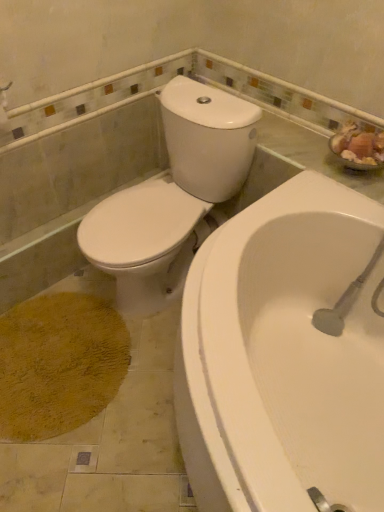
Question: Is white glossy bathtub at lower right inside or outside of white glossy toilet at upper left?

Choices:
 (A) inside
 (B) outside

Answer: (B)

Question: From the image's perspective, is white glossy bathtub at lower right positioned above or below white glossy toilet at upper left?

Choices:
 (A) above
 (B) below

Answer: (B)

Question: Based on their sizes in the image, would you say white glossy bathtub at lower right is bigger or smaller than white glossy toilet at upper left?

Choices:
 (A) small
 (B) big

Answer: (B)

Question: Considering the positions of point (213, 90) and point (251, 399), is point (213, 90) closer or farther from the camera than point (251, 399)?

Choices:
 (A) farther
 (B) closer

Answer: (A)

Question: Considering the positions of white glossy toilet at upper left and white glossy bathtub at lower right in the image, is white glossy toilet at upper left wider or thinner than white glossy bathtub at lower right?

Choices:
 (A) thin
 (B) wide

Answer: (A)

Question: Is white glossy toilet at upper left taller or shorter than white glossy bathtub at lower right?

Choices:
 (A) short
 (B) tall

Answer: (B)

Question: Based on their sizes in the image, would you say white glossy toilet at upper left is bigger or smaller than white glossy bathtub at lower right?

Choices:
 (A) big
 (B) small

Answer: (B)